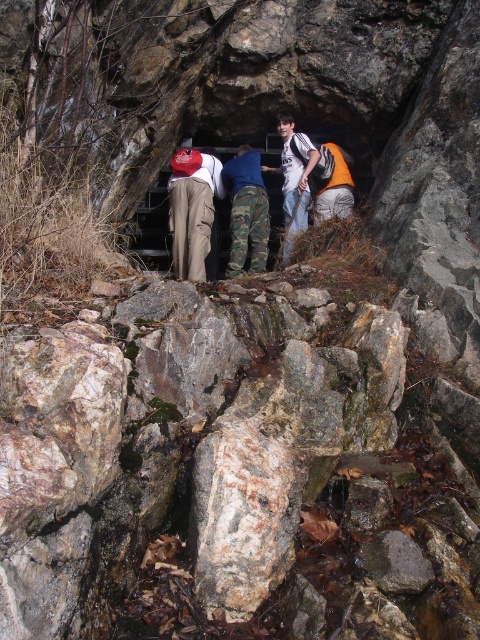
You are a photographer trying to capture the group entering the cave. You want to ensure that the person wearing the matte khaki pants at center is perfectly centered in your shot. Where should you position the camera relative to the group?

To center the matte khaki pants at center, position the camera so that the pants are at the center point of the frame, which corresponds to coordinates approximately 0.328 on the x and 0.400 on the y axis.